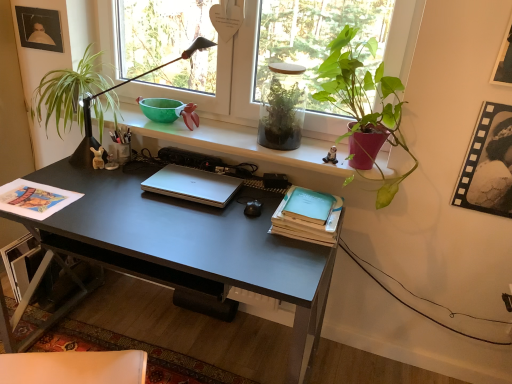
Where is `blank space situated above translucent glass terrarium at center, which is counted as the 2th houseplant, starting from the right (from a real-world perspective)`? The width and height of the screenshot is (512, 384). blank space situated above translucent glass terrarium at center, which is counted as the 2th houseplant, starting from the right (from a real-world perspective) is located at coordinates (288, 67).